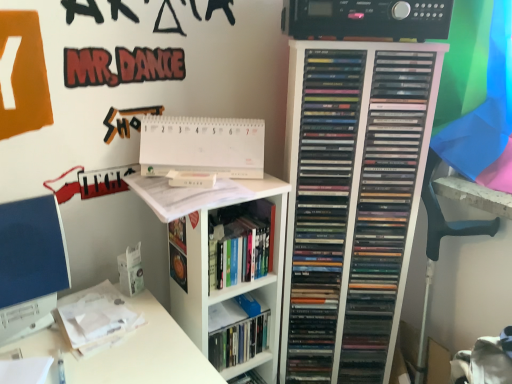
Question: From a real-world perspective, is black plastic stereo at upper center located higher than black plastic swivel chair at right?

Choices:
 (A) no
 (B) yes

Answer: (B)

Question: Considering the relative positions of black plastic stereo at upper center and black plastic swivel chair at right in the image provided, is black plastic stereo at upper center to the right of black plastic swivel chair at right from the viewer's perspective?

Choices:
 (A) yes
 (B) no

Answer: (B)

Question: Is black plastic stereo at upper center positioned before black plastic swivel chair at right?

Choices:
 (A) no
 (B) yes

Answer: (B)

Question: Does black plastic stereo at upper center have a larger size compared to black plastic swivel chair at right?

Choices:
 (A) yes
 (B) no

Answer: (B)

Question: Is black plastic stereo at upper center to the left of black plastic swivel chair at right from the viewer's perspective?

Choices:
 (A) no
 (B) yes

Answer: (B)

Question: Is black plastic stereo at upper center positioned beyond the bounds of black plastic swivel chair at right?

Choices:
 (A) yes
 (B) no

Answer: (A)

Question: Is hardcover book at center taller than black plastic swivel chair at right?

Choices:
 (A) no
 (B) yes

Answer: (A)

Question: From the image's perspective, is hardcover book at center below black plastic swivel chair at right?

Choices:
 (A) no
 (B) yes

Answer: (A)

Question: Does hardcover book at center turn towards black plastic swivel chair at right?

Choices:
 (A) yes
 (B) no

Answer: (B)

Question: Is hardcover book at center surrounding black plastic swivel chair at right?

Choices:
 (A) no
 (B) yes

Answer: (A)

Question: Is hardcover book at center wider than black plastic swivel chair at right?

Choices:
 (A) no
 (B) yes

Answer: (B)

Question: Can you see hardcover book at center touching black plastic swivel chair at right?

Choices:
 (A) no
 (B) yes

Answer: (A)

Question: Is the surface of white paper at upper center, the 1th paperback book when ordered from top to bottom, in direct contact with hardcover book at center?

Choices:
 (A) no
 (B) yes

Answer: (A)